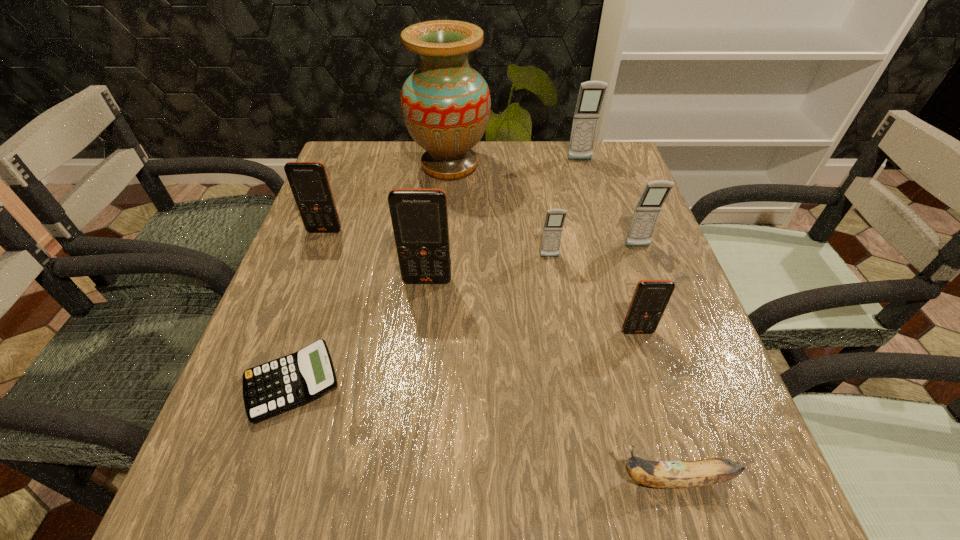
The image size is (960, 540). In order to click on vacant space at the far right corner in this screenshot , I will do `click(614, 164)`.

The image size is (960, 540). Identify the location of vacant space that is in between the nearest gray cellular telephone and the rightmost cellular telephone. (593, 252).

At what (x,y) coordinates should I click in order to perform the action: click on vacant point located between the nearest object and the biggest orange cellular telephone. Please return your answer as a coordinate pair (x, y). Looking at the image, I should click on (551, 380).

This screenshot has width=960, height=540. In order to click on free space between the rightmost cellular telephone and the second gray cellular telephone from right to left in this screenshot , I will do `click(609, 204)`.

This screenshot has width=960, height=540. Find the location of `free point between the nearest object and the shortest object`. free point between the nearest object and the shortest object is located at coordinates (483, 431).

Find the location of `vacant area that lies between the seventh nearest object and the sixth farthest object`. vacant area that lies between the seventh nearest object and the sixth farthest object is located at coordinates (376, 256).

This screenshot has width=960, height=540. I want to click on vacant region between the fourth farthest cellular telephone and the rightmost orange cellular telephone, so click(593, 294).

Where is `empty space that is in between the fifth nearest object and the second farthest orange cellular telephone`? This screenshot has height=540, width=960. empty space that is in between the fifth nearest object and the second farthest orange cellular telephone is located at coordinates (489, 269).

Locate an element on the screen. vacant area that lies between the second gray cellular telephone from right to left and the fifth object from right to left is located at coordinates [564, 208].

Find the location of `object that can be found as the fourth closest to the second orange cellular telephone from right to left`. object that can be found as the fourth closest to the second orange cellular telephone from right to left is located at coordinates (445, 103).